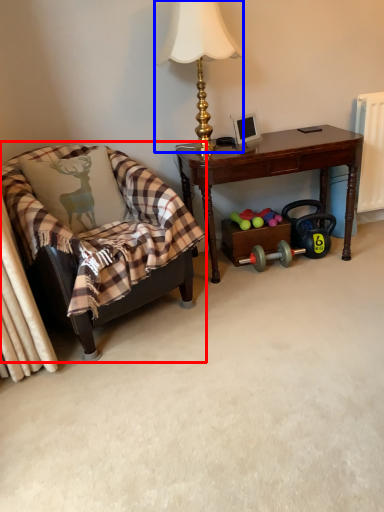
Question: Which of the following is the closest to the observer, chair (highlighted by a red box) or lamp (highlighted by a blue box)?

Choices:
 (A) chair
 (B) lamp

Answer: (A)